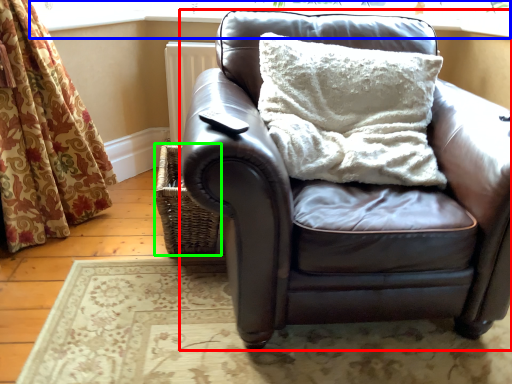
Question: Estimate the real-world distances between objects in this image. Which object is farther from studio couch (highlighted by a red box), window frame (highlighted by a blue box) or basket (highlighted by a green box)?

Choices:
 (A) window frame
 (B) basket

Answer: (A)